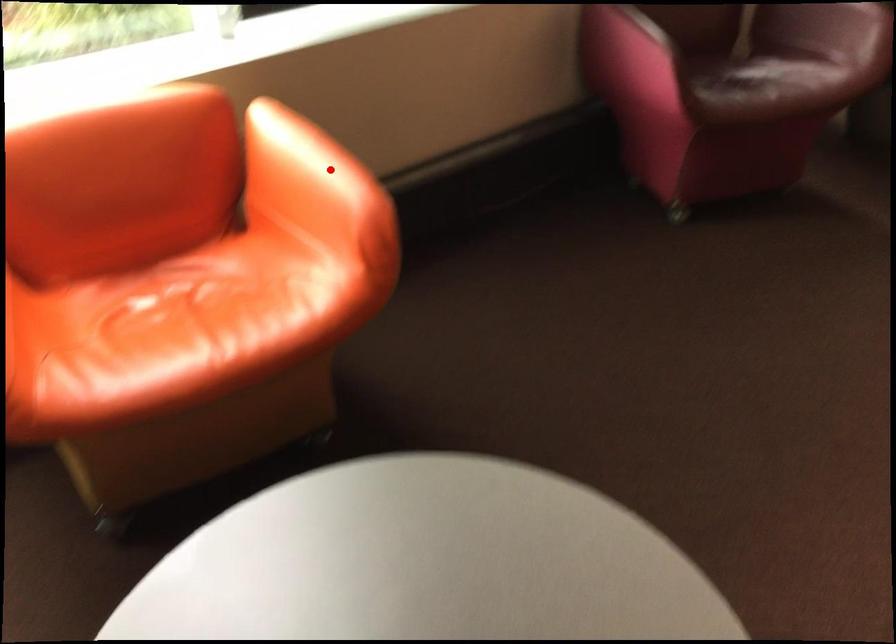
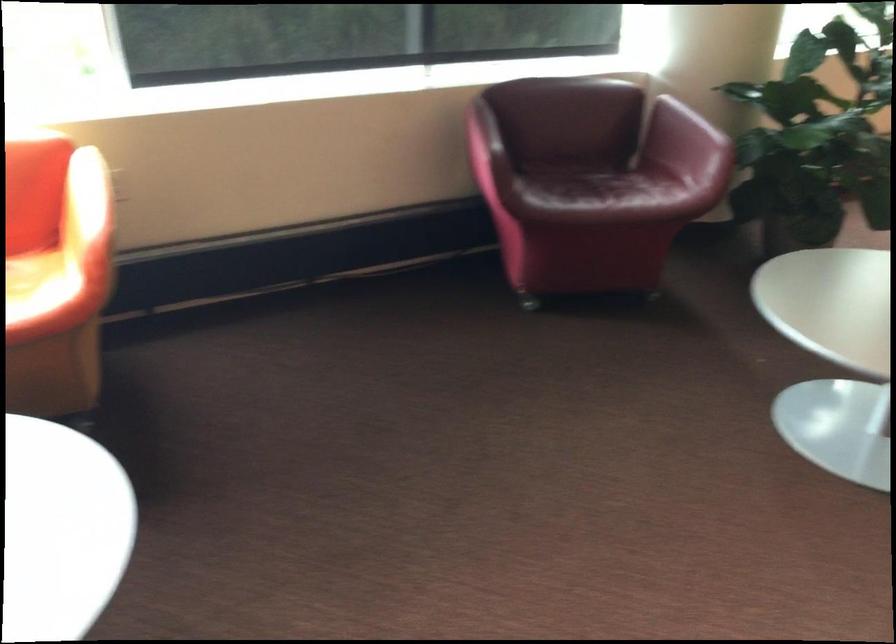
The point at the highlighted location is marked in the first image. Where is the corresponding point in the second image?

(85, 200)